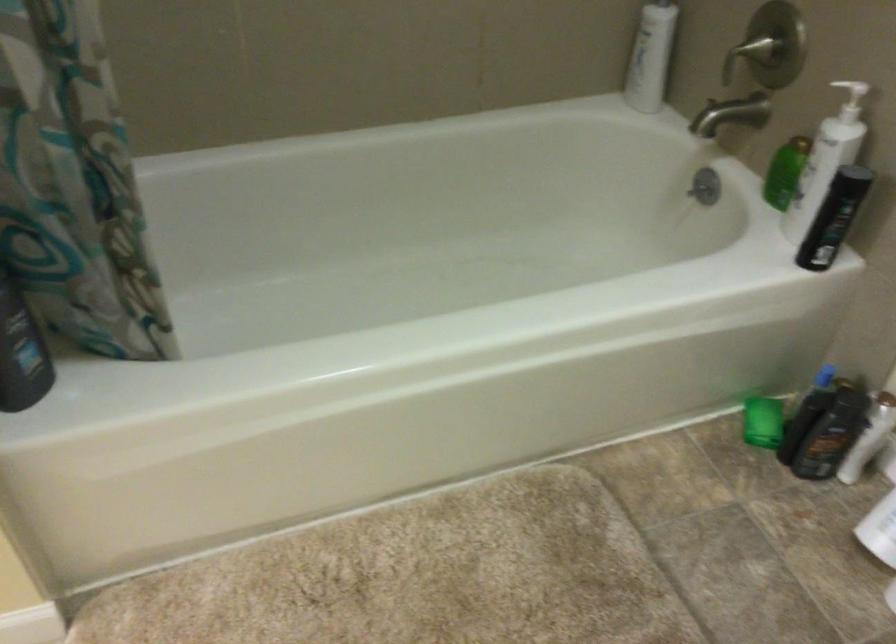
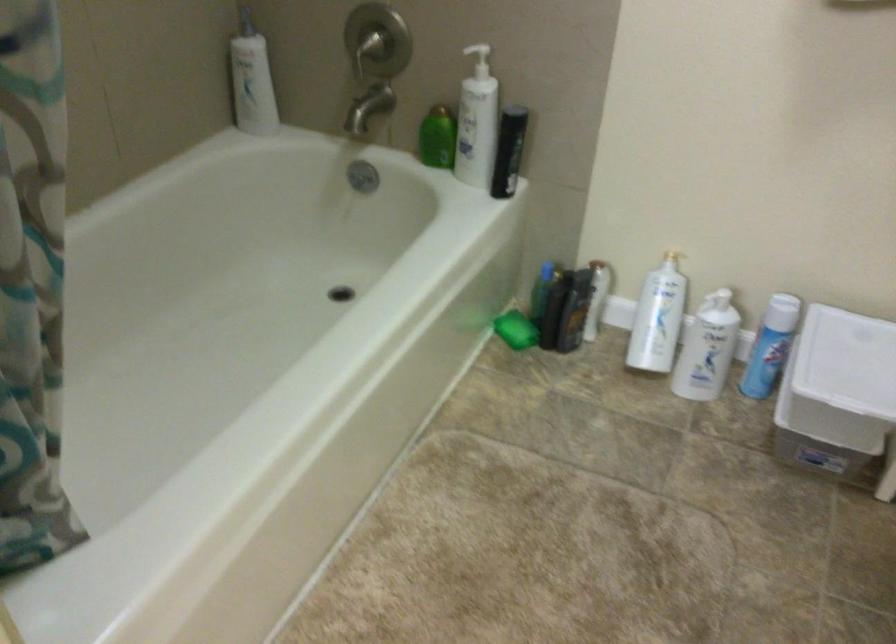
Where in the second image is the point corresponding to the point at 813,171 from the first image?

(477, 122)